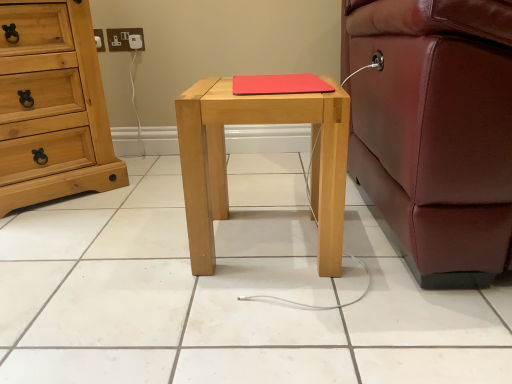
Question: Is there a large distance between light brown wooden chest of drawers at left and red matte mousepad at center?

Choices:
 (A) no
 (B) yes

Answer: (A)

Question: Considering the relative sizes of light brown wooden chest of drawers at left and red matte mousepad at center in the image provided, is light brown wooden chest of drawers at left shorter than red matte mousepad at center?

Choices:
 (A) yes
 (B) no

Answer: (B)

Question: Is light brown wooden chest of drawers at left oriented towards red matte mousepad at center?

Choices:
 (A) yes
 (B) no

Answer: (A)

Question: Is light brown wooden chest of drawers at left at the right side of red matte mousepad at center?

Choices:
 (A) no
 (B) yes

Answer: (A)

Question: Does light brown wooden chest of drawers at left have a smaller size compared to red matte mousepad at center?

Choices:
 (A) yes
 (B) no

Answer: (B)

Question: Looking at their shapes, would you say light brown wooden chest of drawers at left is wider or thinner than white plastic socket at upper left?

Choices:
 (A) thin
 (B) wide

Answer: (B)

Question: From their relative heights in the image, would you say light brown wooden chest of drawers at left is taller or shorter than white plastic socket at upper left?

Choices:
 (A) short
 (B) tall

Answer: (B)

Question: Is light brown wooden chest of drawers at left situated inside white plastic socket at upper left or outside?

Choices:
 (A) inside
 (B) outside

Answer: (B)

Question: In the image, is light brown wooden chest of drawers at left positioned in front of or behind white plastic socket at upper left?

Choices:
 (A) front
 (B) behind

Answer: (A)

Question: From a real-world perspective, relative to light wood/texture nightstand at center, is white plastic socket at upper left vertically above or below?

Choices:
 (A) above
 (B) below

Answer: (A)

Question: Looking at the image, does white plastic socket at upper left seem bigger or smaller compared to light wood/texture nightstand at center?

Choices:
 (A) small
 (B) big

Answer: (A)

Question: Is white plastic socket at upper left spatially inside light wood/texture nightstand at center, or outside of it?

Choices:
 (A) outside
 (B) inside

Answer: (A)

Question: Looking at their shapes, would you say white plastic socket at upper left is wider or thinner than light wood/texture nightstand at center?

Choices:
 (A) thin
 (B) wide

Answer: (A)

Question: Considering the positions of light wood/texture nightstand at center and red matte mousepad at center in the image, is light wood/texture nightstand at center wider or thinner than red matte mousepad at center?

Choices:
 (A) wide
 (B) thin

Answer: (A)

Question: From a real-world perspective, is light wood/texture nightstand at center above or below red matte mousepad at center?

Choices:
 (A) below
 (B) above

Answer: (A)